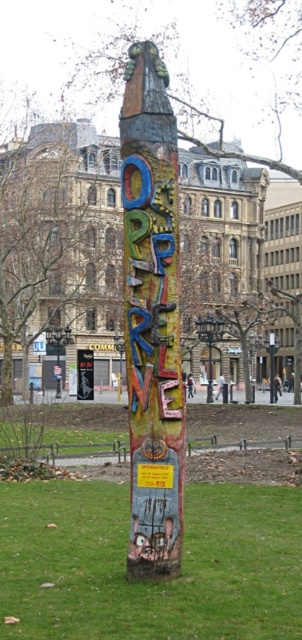
Is green grass at center above multicolored painted totem pole at center?

Incorrect, green grass at center is not positioned above multicolored painted totem pole at center.

Is green grass at center shorter than multicolored painted totem pole at center?

Yes, green grass at center is shorter than multicolored painted totem pole at center.

Who is more distant from viewer, (241, 598) or (140, 54)?

Point (140, 54)

Where is `green grass at center`? green grass at center is located at coordinates (150, 582).